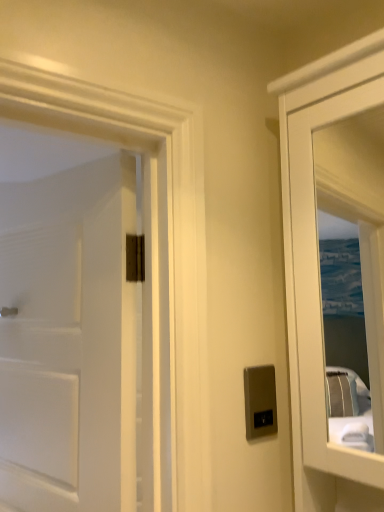
Question: Looking at the image, does white matte door at left seem bigger or smaller compared to satin silver switch at center?

Choices:
 (A) big
 (B) small

Answer: (A)

Question: From a real-world perspective, relative to satin silver switch at center, is white matte door at left vertically above or below?

Choices:
 (A) below
 (B) above

Answer: (B)

Question: Looking at their shapes, would you say white matte door at left is wider or thinner than satin silver switch at center?

Choices:
 (A) wide
 (B) thin

Answer: (A)

Question: Considering their positions, is satin silver switch at center located in front of or behind white matte door at left?

Choices:
 (A) behind
 (B) front

Answer: (A)

Question: Visually, is satin silver switch at center positioned to the left or to the right of white matte door at left?

Choices:
 (A) left
 (B) right

Answer: (B)

Question: Looking at their shapes, would you say satin silver switch at center is wider or thinner than white matte door at left?

Choices:
 (A) wide
 (B) thin

Answer: (B)

Question: From the image's perspective, is satin silver switch at center positioned above or below white matte door at left?

Choices:
 (A) above
 (B) below

Answer: (B)